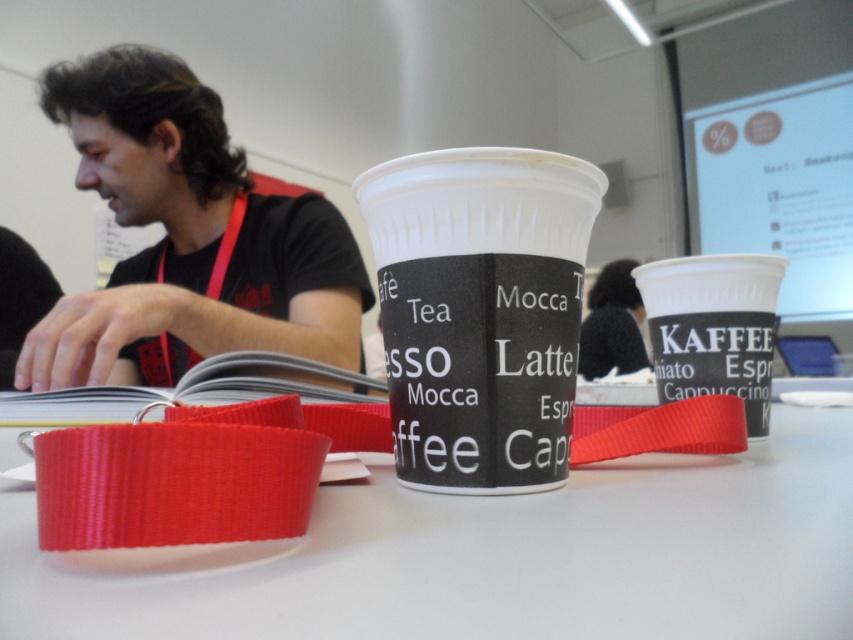
Where is the white plastic table at center located in the image?

The white plastic table at center is located at point (503, 557) in the image.